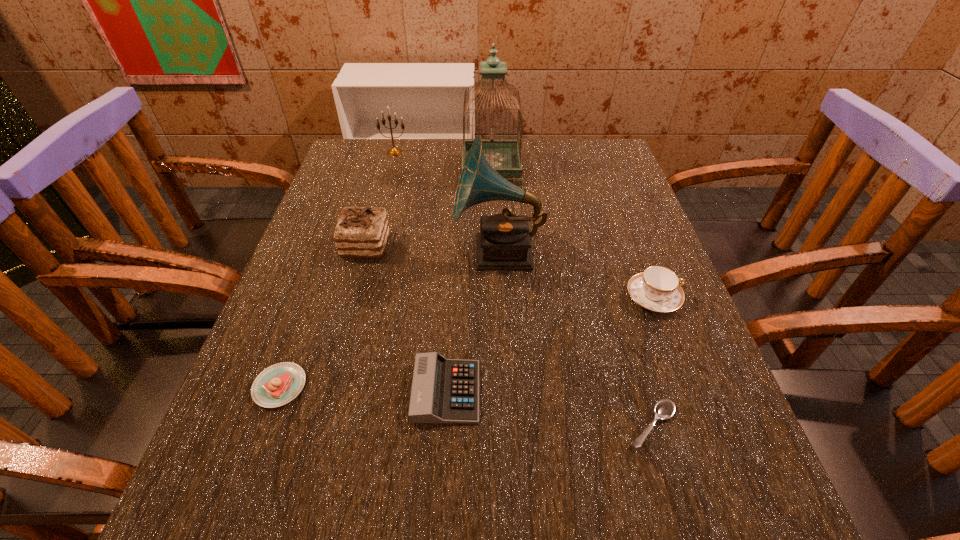
This screenshot has width=960, height=540. In order to click on vacant space at the right edge of the desktop in this screenshot , I will do `click(602, 282)`.

Image resolution: width=960 pixels, height=540 pixels. What are the coordinates of `vacant space at the far left corner of the desktop` in the screenshot? It's located at (385, 166).

Find the location of `vacant space at the near right corner`. vacant space at the near right corner is located at coordinates (756, 514).

Locate an element on the screen. The height and width of the screenshot is (540, 960). empty location between the chocolate cake and the pastry is located at coordinates (323, 316).

Where is `free spot between the shortest object and the third tallest object`? The image size is (960, 540). free spot between the shortest object and the third tallest object is located at coordinates (523, 289).

Where is `free space between the calculator and the fourth shortest object`? The image size is (960, 540). free space between the calculator and the fourth shortest object is located at coordinates (550, 345).

The height and width of the screenshot is (540, 960). I want to click on vacant point located between the tallest object and the teacup, so click(x=572, y=233).

At what (x,y) coordinates should I click in order to perform the action: click on free space between the birdcage and the calculator. Please return your answer as a coordinate pair (x, y). Image resolution: width=960 pixels, height=540 pixels. Looking at the image, I should click on (468, 280).

Where is `vacant space in between the calculator and the second shortest object`? The image size is (960, 540). vacant space in between the calculator and the second shortest object is located at coordinates (363, 389).

Identify the location of free spot between the chocolate cake and the second shortest object. (323, 316).